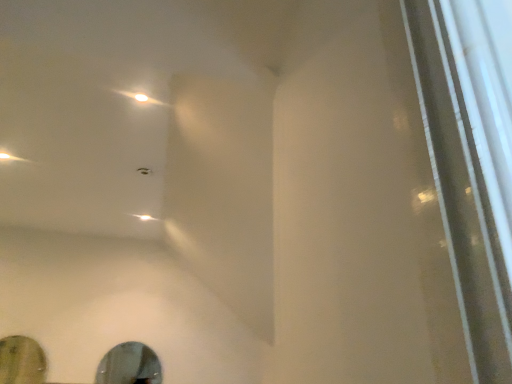
Question: Considering the relative positions of shiny silver mirror at lower center, which is counted as the 2th mirror, starting from the left, and green matte mirror at lower left, arranged as the 1th mirror when viewed from the left, in the image provided, is shiny silver mirror at lower center, which is counted as the 2th mirror, starting from the left, in front of green matte mirror at lower left, arranged as the 1th mirror when viewed from the left,?

Choices:
 (A) no
 (B) yes

Answer: (A)

Question: Does shiny silver mirror at lower center, acting as the 1th mirror starting from the right, touch green matte mirror at lower left, the second mirror from the right?

Choices:
 (A) no
 (B) yes

Answer: (A)

Question: From a real-world perspective, is shiny silver mirror at lower center, which is counted as the 2th mirror, starting from the left, located beneath green matte mirror at lower left, arranged as the 1th mirror when viewed from the left?

Choices:
 (A) no
 (B) yes

Answer: (B)

Question: From the image's perspective, is shiny silver mirror at lower center, which is counted as the 2th mirror, starting from the left, on top of green matte mirror at lower left, the second mirror from the right?

Choices:
 (A) no
 (B) yes

Answer: (A)

Question: Is shiny silver mirror at lower center, which is counted as the 2th mirror, starting from the left, smaller than green matte mirror at lower left, the second mirror from the right?

Choices:
 (A) no
 (B) yes

Answer: (B)

Question: Is shiny silver mirror at lower center, which is counted as the 2th mirror, starting from the left, not near green matte mirror at lower left, arranged as the 1th mirror when viewed from the left?

Choices:
 (A) yes
 (B) no

Answer: (B)

Question: Considering the relative sizes of green matte mirror at lower left, the second mirror from the right, and shiny silver mirror at lower center, which is counted as the 2th mirror, starting from the left, in the image provided, is green matte mirror at lower left, the second mirror from the right, thinner than shiny silver mirror at lower center, which is counted as the 2th mirror, starting from the left,?

Choices:
 (A) yes
 (B) no

Answer: (B)

Question: From the image's perspective, is green matte mirror at lower left, the second mirror from the right, on top of shiny silver mirror at lower center, which is counted as the 2th mirror, starting from the left?

Choices:
 (A) no
 (B) yes

Answer: (B)

Question: Does green matte mirror at lower left, arranged as the 1th mirror when viewed from the left, appear on the left side of shiny silver mirror at lower center, acting as the 1th mirror starting from the right?

Choices:
 (A) no
 (B) yes

Answer: (B)

Question: Considering the relative sizes of green matte mirror at lower left, arranged as the 1th mirror when viewed from the left, and shiny silver mirror at lower center, acting as the 1th mirror starting from the right, in the image provided, is green matte mirror at lower left, arranged as the 1th mirror when viewed from the left, shorter than shiny silver mirror at lower center, acting as the 1th mirror starting from the right,?

Choices:
 (A) no
 (B) yes

Answer: (A)

Question: From the image's perspective, is green matte mirror at lower left, arranged as the 1th mirror when viewed from the left, under shiny silver mirror at lower center, which is counted as the 2th mirror, starting from the left?

Choices:
 (A) no
 (B) yes

Answer: (A)

Question: From a real-world perspective, is green matte mirror at lower left, the second mirror from the right, below shiny silver mirror at lower center, which is counted as the 2th mirror, starting from the left?

Choices:
 (A) no
 (B) yes

Answer: (A)

Question: From a real-world perspective, is shiny silver mirror at lower center, which is counted as the 2th mirror, starting from the left, positioned above or below green matte mirror at lower left, arranged as the 1th mirror when viewed from the left?

Choices:
 (A) below
 (B) above

Answer: (A)